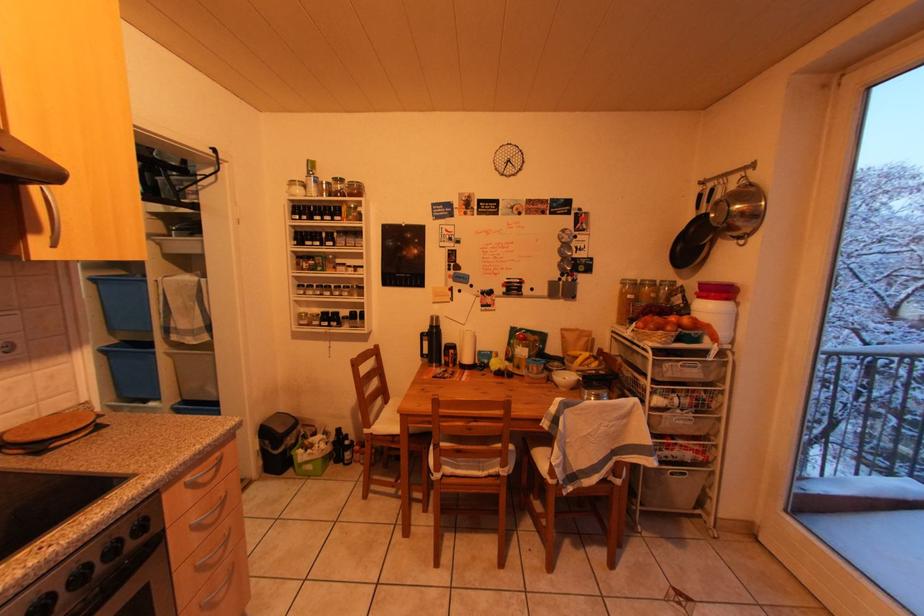
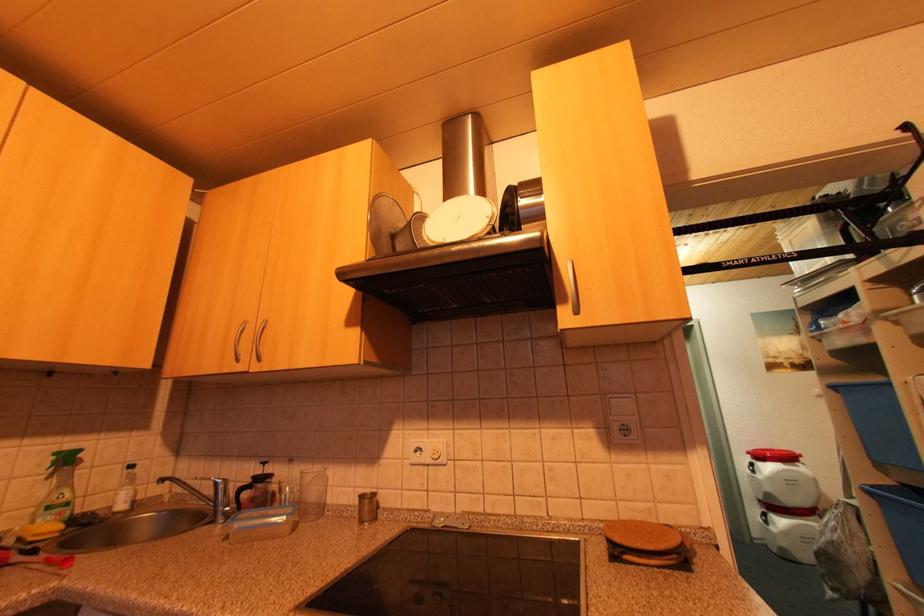
Question: How did the camera likely rotate?

Choices:
 (A) Left
 (B) Right
 (C) Up
 (D) Down

Answer: (A)